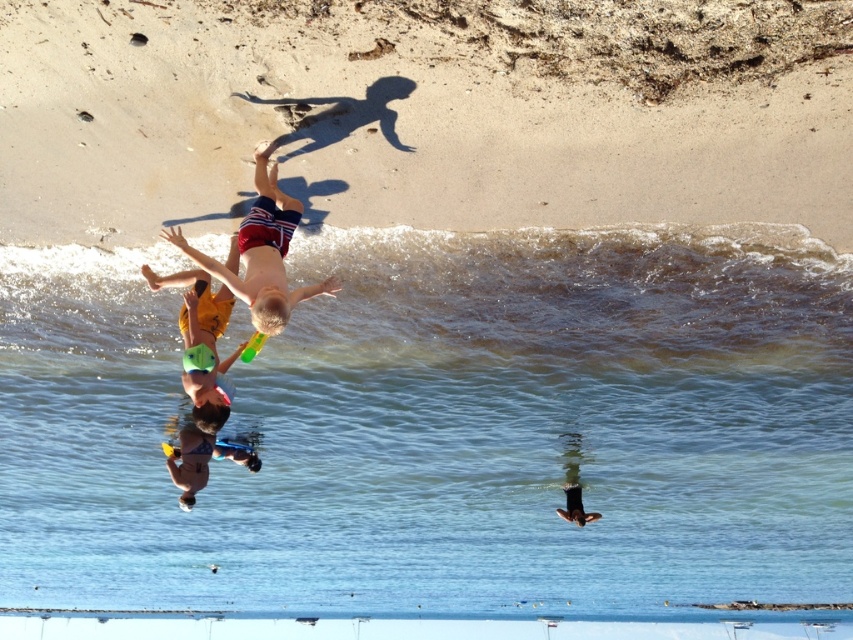
You are a lifeguard observing the beach scene. There is a point marked at coordinates (573, 300) which is labeled as clear water at wave upper. Based on the scene description, where would this point most likely be located relative to the two divers?

The point marked at coordinates (573, 300) indicating clear water at wave upper is likely located above the waves where the divers are diving into, suggesting it is the area where the water is calm and clear for them to dive safely.

You are a lifeguard assessing the diving area. You notice the clear water at wave upper and the red and white striped shorts at center. Which object is larger in size?

The red and white striped shorts at center is larger than the clear water at wave upper.

You are a lifeguard assessing the scene. The coordinates given are part of the diving area. Is the point at coordinates point (573, 300) located in the clear water area above the waves where divers typically aim to land?

The point (573, 300) is on clear water at wave upper, so yes, it is in the clear water area above the waves where divers typically aim to land.